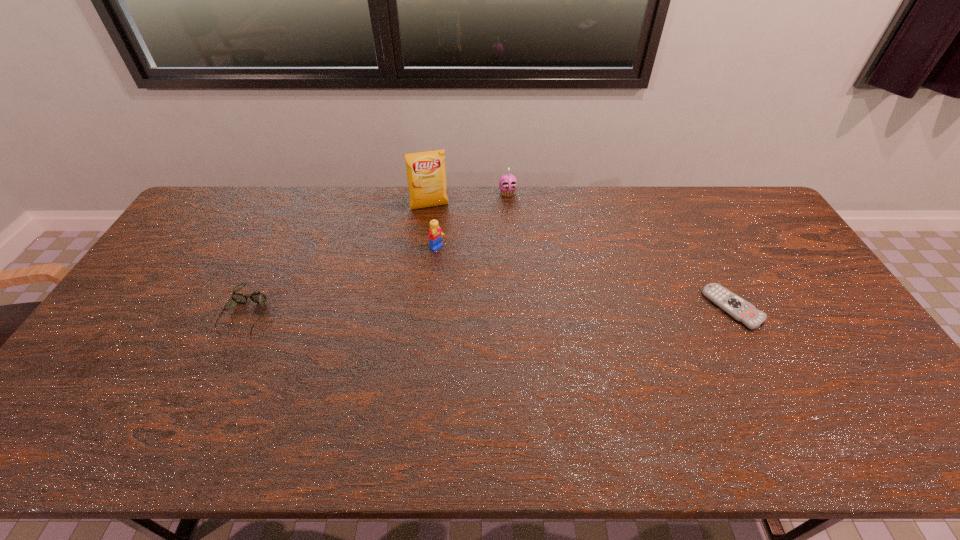
Identify the location of free space that is in between the crisp (potato chip) and the second shortest object. (338, 260).

Locate an element on the screen. The width and height of the screenshot is (960, 540). vacant area between the third farthest object and the leftmost object is located at coordinates (342, 281).

The height and width of the screenshot is (540, 960). Find the location of `vacant area that lies between the leftmost object and the third farthest object`. vacant area that lies between the leftmost object and the third farthest object is located at coordinates (342, 281).

The image size is (960, 540). Find the location of `empty location between the second shortest object and the farthest object`. empty location between the second shortest object and the farthest object is located at coordinates (377, 253).

Identify the location of vacant area that lies between the second shortest object and the fourth nearest object. Image resolution: width=960 pixels, height=540 pixels. (338, 260).

The width and height of the screenshot is (960, 540). In order to click on the fourth closest object to the shortest object in this screenshot , I will do `click(257, 297)`.

Locate an element on the screen. The width and height of the screenshot is (960, 540). the second closest object relative to the rightmost object is located at coordinates (435, 233).

Locate an element on the screen. vacant region that satisfies the following two spatial constraints: 1. on the back side of the cupcake; 2. on the right side of the Lego is located at coordinates (443, 193).

Where is `vacant position in the image that satisfies the following two spatial constraints: 1. on the back side of the second object from right to left; 2. on the left side of the tallest object`? vacant position in the image that satisfies the following two spatial constraints: 1. on the back side of the second object from right to left; 2. on the left side of the tallest object is located at coordinates (431, 193).